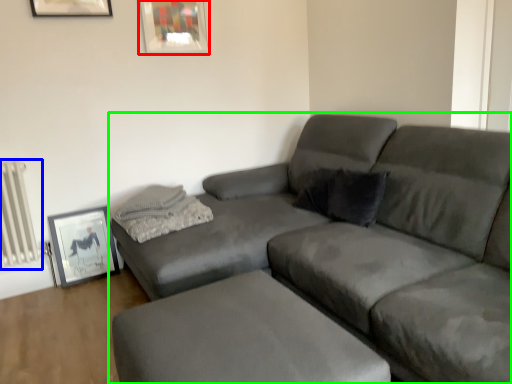
Question: Which object is the closest to the picture frame (highlighted by a red box)? Choose among these: radiator (highlighted by a blue box) or studio couch (highlighted by a green box).

Choices:
 (A) radiator
 (B) studio couch

Answer: (A)